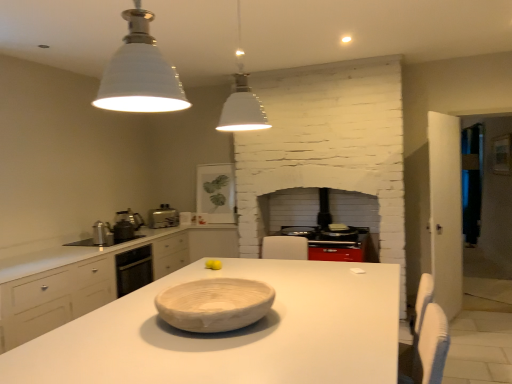
The width and height of the screenshot is (512, 384). Find the location of `free spot above natural wood bowl at center (from a real-world perspective)`. free spot above natural wood bowl at center (from a real-world perspective) is located at coordinates (220, 292).